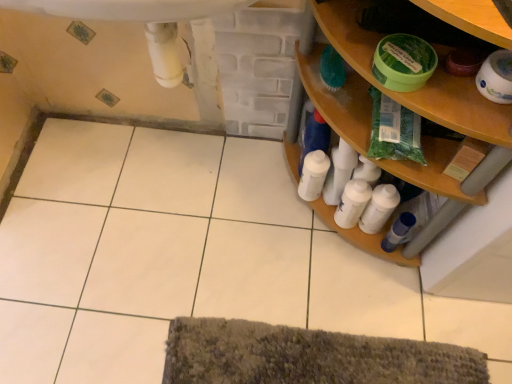
This screenshot has width=512, height=384. I want to click on space that is in front of blue glossy bottle at lower right, which appears as the first toiletry when viewed from the right, so click(x=395, y=304).